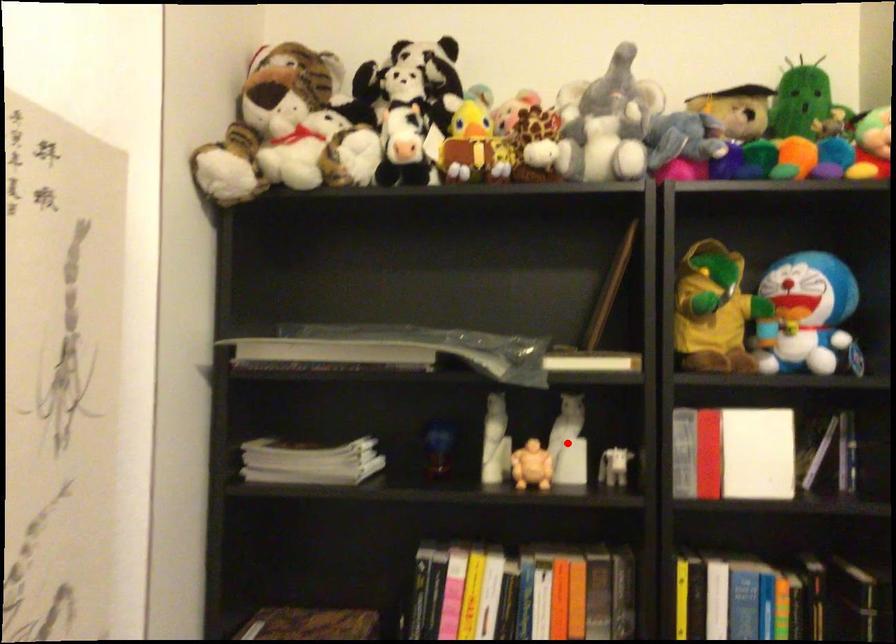
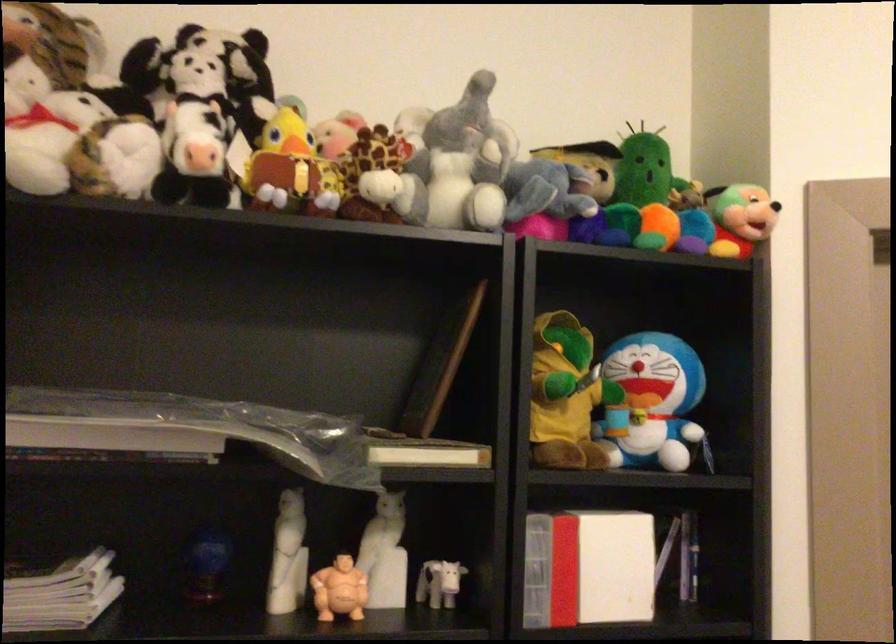
Question: I am providing you with two images of the same scene from different viewpoints. In image1, a red point is highlighted. Considering the same 3D point in image2, which of the following is correct?

Choices:
 (A) It is closer
 (B) It is farther

Answer: (A)